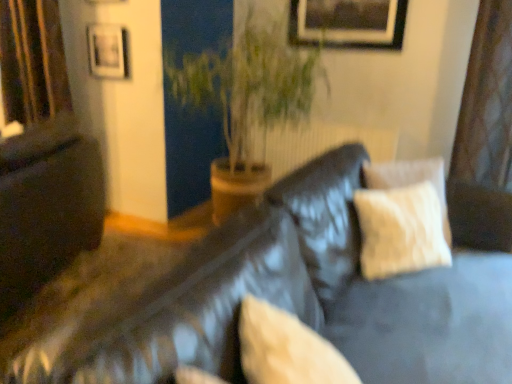
What do you see at coordinates (246, 101) in the screenshot? I see `green leafy plant at center` at bounding box center [246, 101].

Measure the distance between matte black couch at left and camera.

They are 1.88 meters apart.

Measure the distance between point (90,172) and camera.

Point (90,172) is 8.54 feet from camera.

Where is `beige fabric pillow at center`? This screenshot has height=384, width=512. beige fabric pillow at center is located at coordinates (286, 349).

The height and width of the screenshot is (384, 512). What are the coordinates of `green leafy plant at center` in the screenshot? It's located at (246, 101).

Identify the location of houseplant in front of the silky brown curtain at left. Image resolution: width=512 pixels, height=384 pixels. (246, 101).

Looking at their sizes, would you say green leafy plant at center is wider or thinner than silky brown curtain at left?

green leafy plant at center is wider than silky brown curtain at left.

How many degrees apart are the facing directions of green leafy plant at center and silky brown curtain at left?

They differ by 0.000302 degrees in their facing directions.

Relative to silky brown curtain at left, is green leafy plant at center in front or behind?

green leafy plant at center is positioned closer to the viewer than silky brown curtain at left.

In the image, there is a green leafy plant at center. At what (x,y) coordinates should I click in order to perform the action: click on pillow below it (from the image's perspective). Please return your answer as a coordinate pair (x, y). Image resolution: width=512 pixels, height=384 pixels. Looking at the image, I should click on (286, 349).

From the image's perspective, which is below, green leafy plant at center or beige fabric pillow at center?

beige fabric pillow at center appears lower in the image.

In terms of size, does green leafy plant at center appear bigger or smaller than beige fabric pillow at center?

green leafy plant at center is bigger than beige fabric pillow at center.

Between green leafy plant at center and matte black picture frame at upper left, which is the first picture frame in left-to-right order, which one has larger width?

green leafy plant at center.

In terms of height, does green leafy plant at center look taller or shorter compared to matte black picture frame at upper left, arranged as the 2th picture frame when viewed from the right?

In the image, green leafy plant at center appears to be taller than matte black picture frame at upper left, arranged as the 2th picture frame when viewed from the right.

Between green leafy plant at center and matte black picture frame at upper left, which is the first picture frame in left-to-right order, which one appears on the right side from the viewer's perspective?

green leafy plant at center is more to the right.

Measure the distance between green leafy plant at center and matte black picture frame at upper left, arranged as the 2th picture frame when viewed from the right.

green leafy plant at center and matte black picture frame at upper left, arranged as the 2th picture frame when viewed from the right, are 31.41 inches apart from each other.

Can you confirm if green leafy plant at center is positioned to the left of wooden picture frame at upper center, the second picture frame viewed from the left?

Correct, you'll find green leafy plant at center to the left of wooden picture frame at upper center, the second picture frame viewed from the left.

Considering the positions of points (290, 84) and (380, 0), is point (290, 84) farther from camera compared to point (380, 0)?

No.

Considering the relative sizes of green leafy plant at center and wooden picture frame at upper center, the 1th picture frame when ordered from right to left, in the image provided, is green leafy plant at center taller than wooden picture frame at upper center, the 1th picture frame when ordered from right to left,?

Yes, green leafy plant at center is taller than wooden picture frame at upper center, the 1th picture frame when ordered from right to left.

Can you confirm if green leafy plant at center is bigger than wooden picture frame at upper center, the 1th picture frame when ordered from right to left?

Yes.

Could you measure the distance between matte black picture frame at upper left, which is the first picture frame in left-to-right order, and leather couch at center?

matte black picture frame at upper left, which is the first picture frame in left-to-right order, and leather couch at center are 6.47 feet apart from each other.

Considering the relative positions of matte black picture frame at upper left, which is the first picture frame in left-to-right order, and leather couch at center in the image provided, is matte black picture frame at upper left, which is the first picture frame in left-to-right order, to the left of leather couch at center from the viewer's perspective?

Indeed, matte black picture frame at upper left, which is the first picture frame in left-to-right order, is positioned on the left side of leather couch at center.

From the image's perspective, is matte black picture frame at upper left, arranged as the 2th picture frame when viewed from the right, above or below leather couch at center?

matte black picture frame at upper left, arranged as the 2th picture frame when viewed from the right, is situated higher than leather couch at center in the image.

Image resolution: width=512 pixels, height=384 pixels. In order to click on studio couch below the matte black picture frame at upper left, arranged as the 2th picture frame when viewed from the right (from a real-world perspective) in this screenshot , I will do `click(270, 298)`.

Does silky brown curtain at left appear on the left side of wooden picture frame at upper center, the 1th picture frame when ordered from right to left?

Indeed, silky brown curtain at left is positioned on the left side of wooden picture frame at upper center, the 1th picture frame when ordered from right to left.

Considering the relative sizes of silky brown curtain at left and wooden picture frame at upper center, the 1th picture frame when ordered from right to left, in the image provided, is silky brown curtain at left smaller than wooden picture frame at upper center, the 1th picture frame when ordered from right to left,?

No.

From a real-world perspective, which object stands above the other?

wooden picture frame at upper center, the 1th picture frame when ordered from right to left.

Considering the sizes of objects silky brown curtain at left and wooden picture frame at upper center, the 1th picture frame when ordered from right to left, in the image provided, who is shorter, silky brown curtain at left or wooden picture frame at upper center, the 1th picture frame when ordered from right to left,?

With less height is wooden picture frame at upper center, the 1th picture frame when ordered from right to left.

From a real-world perspective, which is physically below, beige fabric pillow at center or silky brown curtain at left?

From a 3D spatial view, beige fabric pillow at center is below.

Can you tell me how much beige fabric pillow at center and silky brown curtain at left differ in facing direction?

135 degrees.

From the image's perspective, which is below, beige fabric pillow at center or silky brown curtain at left?

beige fabric pillow at center appears lower in the image.

Based on the photo, is beige fabric pillow at center far from silky brown curtain at left?

beige fabric pillow at center is positioned a significant distance from silky brown curtain at left.

You are a GUI agent. You are given a task and a screenshot of the screen. Output one action in this format:
    pyautogui.click(x=<x>, y=<y>)
    Task: Click on the curtain that is above the green leafy plant at center (from the image's perspective)
    The height and width of the screenshot is (384, 512).
    Given the screenshot: What is the action you would take?
    pyautogui.click(x=32, y=60)

Locate an element on the screen. The width and height of the screenshot is (512, 384). pillow below the green leafy plant at center (from a real-world perspective) is located at coordinates (286, 349).

When comparing their distances from beige fabric pillow at center, does leather couch at center or matte black couch at left seem further?

matte black couch at left.

Based on the photo, from the image, which object appears to be nearer to leather couch at center, wooden picture frame at upper center, the second picture frame viewed from the left, or matte black couch at left?

Among the two, matte black couch at left is located nearer to leather couch at center.

Considering their positions, is green leafy plant at center positioned closer to matte black couch at left than wooden picture frame at upper center, the second picture frame viewed from the left?

green leafy plant at center is positioned closer to the anchor matte black couch at left.

Considering their positions, is beige fabric pillow at center positioned further to green leafy plant at center than leather couch at center?

Based on the image, beige fabric pillow at center appears to be further to green leafy plant at center.

From the image, which object appears to be nearer to matte black picture frame at upper left, which is the first picture frame in left-to-right order, silky brown curtain at left or leather couch at center?

Among the two, silky brown curtain at left is located nearer to matte black picture frame at upper left, which is the first picture frame in left-to-right order.

Estimate the real-world distances between objects in this image. Which object is further from matte black couch at left, wooden picture frame at upper center, the second picture frame viewed from the left, or leather couch at center?

Based on the image, wooden picture frame at upper center, the second picture frame viewed from the left, appears to be further to matte black couch at left.

Estimate the real-world distances between objects in this image. Which object is further from wooden picture frame at upper center, the second picture frame viewed from the left, green leafy plant at center or leather couch at center?

Among the two, leather couch at center is located further to wooden picture frame at upper center, the second picture frame viewed from the left.

From the image, which object appears to be farther from leather couch at center, silky brown curtain at left or matte black picture frame at upper left, which is the first picture frame in left-to-right order?

Based on the image, silky brown curtain at left appears to be further to leather couch at center.

The height and width of the screenshot is (384, 512). I want to click on houseplant between leather couch at center and matte black picture frame at upper left, arranged as the 2th picture frame when viewed from the right, in the front-back direction, so click(x=246, y=101).

Identify the location of picture frame situated between matte black couch at left and green leafy plant at center from left to right. The image size is (512, 384). (108, 51).

Locate an element on the screen. This screenshot has height=384, width=512. houseplant between beige fabric pillow at center and wooden picture frame at upper center, the second picture frame viewed from the left, along the z-axis is located at coordinates (246, 101).

The height and width of the screenshot is (384, 512). I want to click on pillow located between leather couch at center and green leafy plant at center in the depth direction, so click(286, 349).